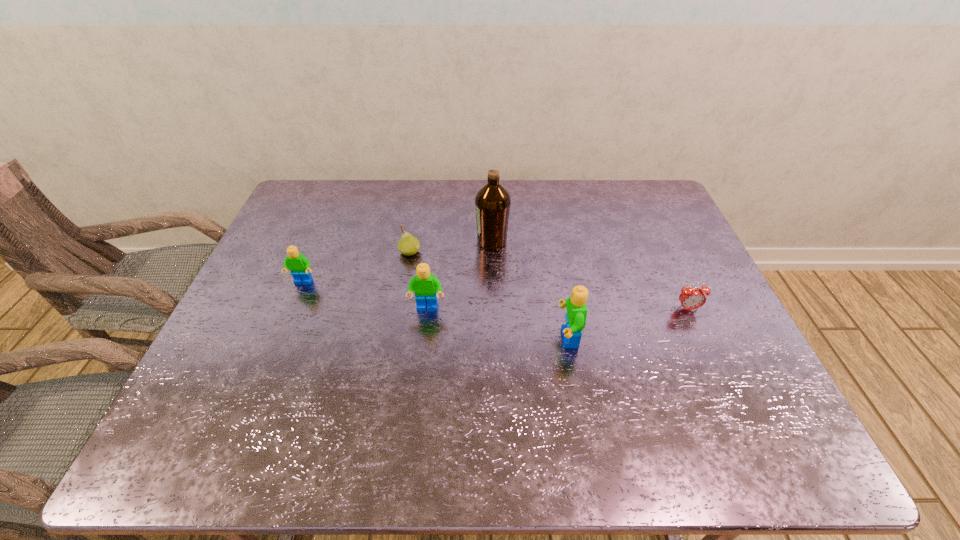
Where is `object at the left edge`? object at the left edge is located at coordinates (299, 265).

Locate an element on the screen. object located in the right edge section of the desktop is located at coordinates (691, 298).

Where is `free region at the far edge of the desktop`? Image resolution: width=960 pixels, height=540 pixels. free region at the far edge of the desktop is located at coordinates (516, 191).

Image resolution: width=960 pixels, height=540 pixels. What are the coordinates of `vacant space at the right edge` in the screenshot? It's located at (687, 279).

This screenshot has width=960, height=540. In order to click on free space at the far left corner of the desktop in this screenshot , I will do `click(314, 207)`.

Where is `free space at the near left corner`? This screenshot has height=540, width=960. free space at the near left corner is located at coordinates (265, 375).

Locate an element on the screen. free area in between the nearest object and the third object from right to left is located at coordinates (530, 289).

Where is `free space between the second Lego from right to left and the tallest object`? This screenshot has height=540, width=960. free space between the second Lego from right to left and the tallest object is located at coordinates (460, 275).

The width and height of the screenshot is (960, 540). Identify the location of vacant area between the third object from right to left and the fifth object from left to right. (530, 289).

The image size is (960, 540). I want to click on free space between the pear and the tallest object, so click(x=451, y=247).